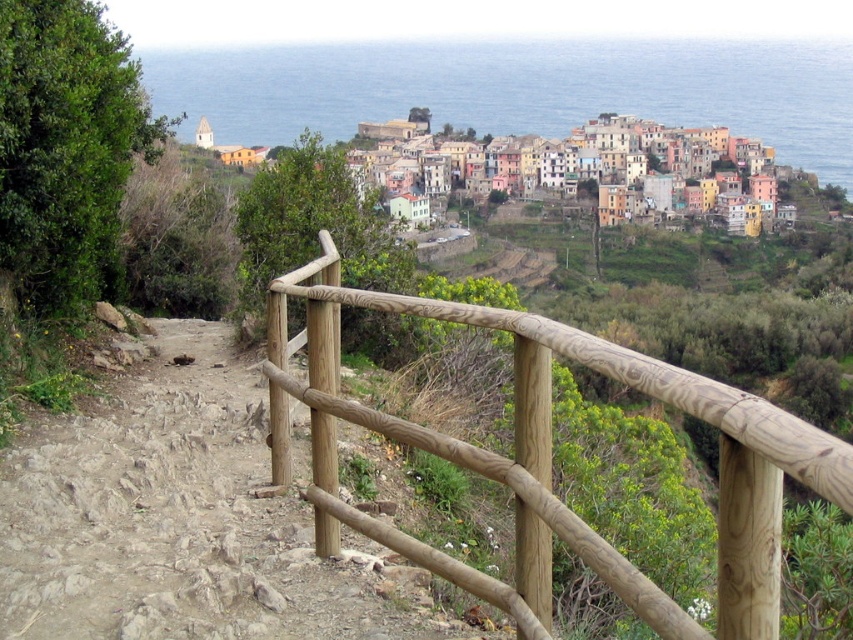
Question: Which of these objects is positioned farthest from the natural wood railing at center?

Choices:
 (A) pastel painted houses at center
 (B) brown dirt trail at lower left

Answer: (A)

Question: Estimate the real-world distances between objects in this image. Which object is farther from the natural wood railing at center?

Choices:
 (A) pastel painted houses at center
 (B) brown dirt trail at lower left

Answer: (A)

Question: Is brown dirt trail at lower left to the left of natural wood railing at center from the viewer's perspective?

Choices:
 (A) yes
 (B) no

Answer: (A)

Question: Is brown dirt trail at lower left closer to the viewer compared to pastel painted houses at center?

Choices:
 (A) yes
 (B) no

Answer: (A)

Question: Which object appears closest to the camera in this image?

Choices:
 (A) natural wood railing at center
 (B) pastel painted houses at center

Answer: (A)

Question: Is brown dirt trail at lower left smaller than pastel painted houses at center?

Choices:
 (A) no
 (B) yes

Answer: (B)